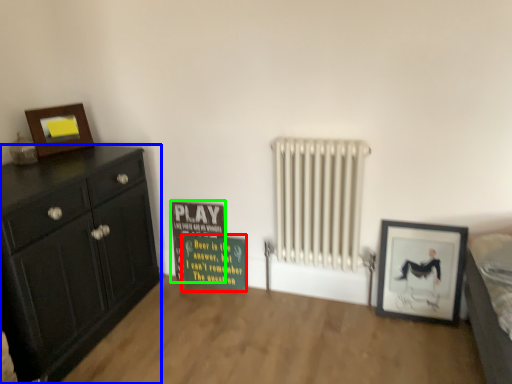
Question: Which object is the closest to the warning sign (highlighted by a red box)? Choose among these: chest of drawers (highlighted by a blue box) or bulletin board (highlighted by a green box).

Choices:
 (A) chest of drawers
 (B) bulletin board

Answer: (B)